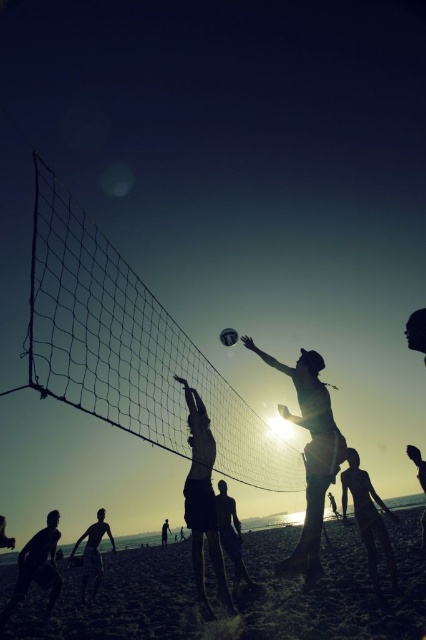
You are a photographer trying to capture the perfect shot of the volleyball game. You notice two points marked in the image at coordinates point (322, 406) and point (97, 572). Based on their positions, which point is closer to the camera?

Point (322, 406) is in front of point (97, 572), so it is closer to the camera.

Looking at this image, you are a photographer trying to capture the perfect shot of the volleyball game. You notice the silhouette of person at center and the silhouette sand at lower right. Which object should you focus on if you want to highlight something taller in the scene?

The silhouette of person at center is taller than the silhouette sand at lower right, so you should focus on the silhouette of person at center to highlight the taller object.